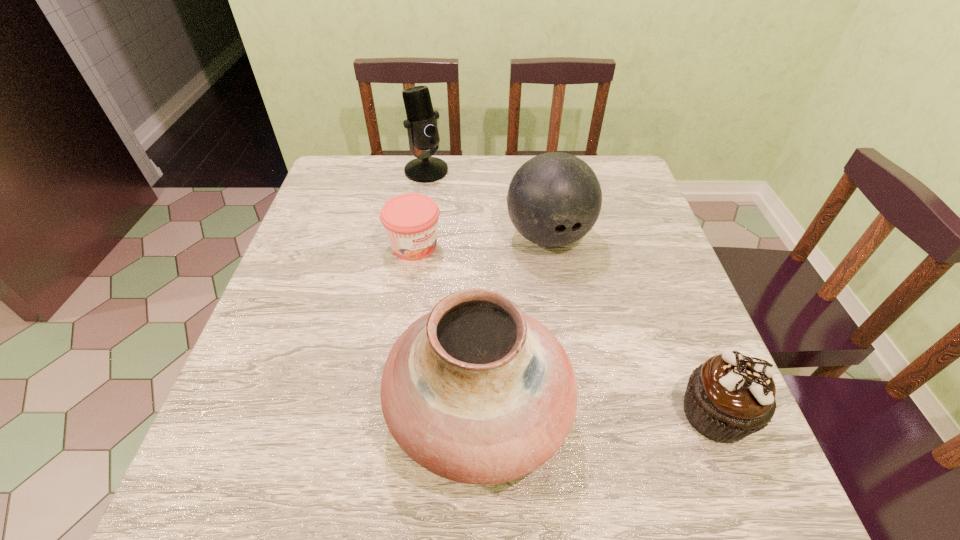
Find the location of a particular element. Image resolution: width=960 pixels, height=540 pixels. object at the right edge is located at coordinates (730, 396).

Where is `object at the near right corner`? This screenshot has width=960, height=540. object at the near right corner is located at coordinates (730, 396).

Where is `free spot at the far edge of the desktop`? free spot at the far edge of the desktop is located at coordinates (454, 159).

At what (x,y) coordinates should I click in order to perform the action: click on free space at the near edge of the desktop. Please return your answer as a coordinate pair (x, y). The image size is (960, 540). Looking at the image, I should click on (614, 396).

Locate an element on the screen. This screenshot has height=540, width=960. free space at the left edge of the desktop is located at coordinates (306, 299).

Locate an element on the screen. vacant space at the right edge of the desktop is located at coordinates (609, 208).

The width and height of the screenshot is (960, 540). What are the coordinates of `vacant space at the far left corner of the desktop` in the screenshot? It's located at (334, 191).

Image resolution: width=960 pixels, height=540 pixels. I want to click on free location at the near left corner of the desktop, so click(x=306, y=418).

In the image, there is a desktop. What are the coordinates of `free space at the far right corner` in the screenshot? It's located at (582, 159).

You are a GUI agent. You are given a task and a screenshot of the screen. Output one action in this format:
    pyautogui.click(x=<x>, y=<y>)
    Task: Click on the free point between the microphone and the rightmost object
    This screenshot has height=540, width=960.
    Given the screenshot: What is the action you would take?
    pyautogui.click(x=571, y=292)